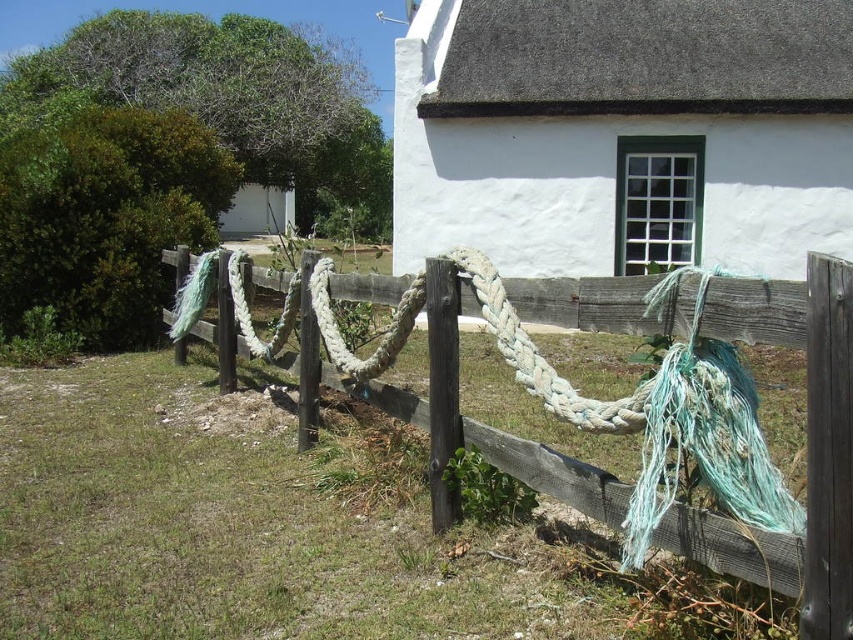
Describe the element at coordinates (624, 132) in the screenshot. I see `white matte fence at center` at that location.

Measure the distance from white matte fence at center to worn wood fence at center.

white matte fence at center and worn wood fence at center are 8.24 meters apart.

Where is `white matte fence at center`? Image resolution: width=853 pixels, height=640 pixels. white matte fence at center is located at coordinates (624, 132).

Is white matte fence at center to the left of worn white rope at center from the viewer's perspective?

Incorrect, white matte fence at center is not on the left side of worn white rope at center.

Does white matte fence at center come in front of worn white rope at center?

No, it is behind worn white rope at center.

What are the coordinates of `white matte fence at center` in the screenshot? It's located at (624, 132).

Can you confirm if worn wood fence at center is positioned to the left of worn white rope at center?

No, worn wood fence at center is not to the left of worn white rope at center.

Does worn wood fence at center have a smaller size compared to worn white rope at center?

No, worn wood fence at center is not smaller than worn white rope at center.

Is point (824, 612) farther from viewer compared to point (402, 326)?

No, it is in front of (402, 326).

The width and height of the screenshot is (853, 640). What are the coordinates of `worn wood fence at center` in the screenshot? It's located at (807, 445).